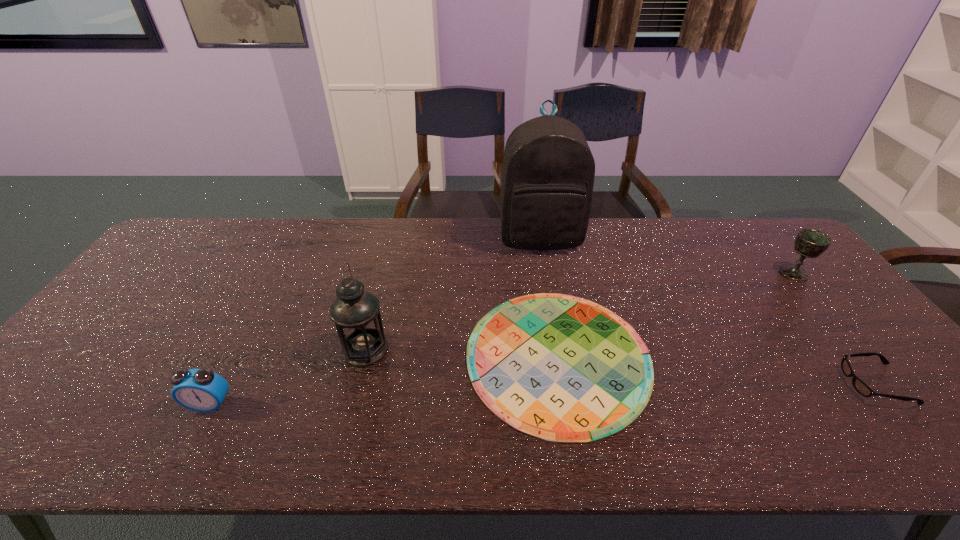
You are a GUI agent. You are given a task and a screenshot of the screen. Output one action in this format:
    pyautogui.click(x=<x>, y=<y>)
    Task: Click on the chalice positioned at the right edge
    This screenshot has height=540, width=960.
    Given the screenshot: What is the action you would take?
    pyautogui.click(x=811, y=243)

Where is `spectacles positioned at the right edge`? The width and height of the screenshot is (960, 540). spectacles positioned at the right edge is located at coordinates (863, 389).

This screenshot has width=960, height=540. In order to click on vacant space at the far edge of the desktop in this screenshot , I will do `click(381, 251)`.

In the image, there is a desktop. What are the coordinates of `free space at the near edge` in the screenshot? It's located at (847, 428).

The width and height of the screenshot is (960, 540). What are the coordinates of `free space at the left edge of the desktop` in the screenshot? It's located at (149, 289).

The width and height of the screenshot is (960, 540). What are the coordinates of `vacant area at the right edge` in the screenshot? It's located at (887, 407).

Locate an element on the screen. Image resolution: width=960 pixels, height=540 pixels. vacant space at the far left corner of the desktop is located at coordinates (224, 228).

At what (x,y) coordinates should I click in order to perform the action: click on free space at the far right corner. Please return your answer as a coordinate pair (x, y). The image size is (960, 540). Looking at the image, I should click on (749, 251).

This screenshot has width=960, height=540. Identify the location of vacant area that lies between the shortest object and the oil lamp. (462, 353).

This screenshot has width=960, height=540. I want to click on vacant area that lies between the gameboard and the second object from left to right, so click(462, 353).